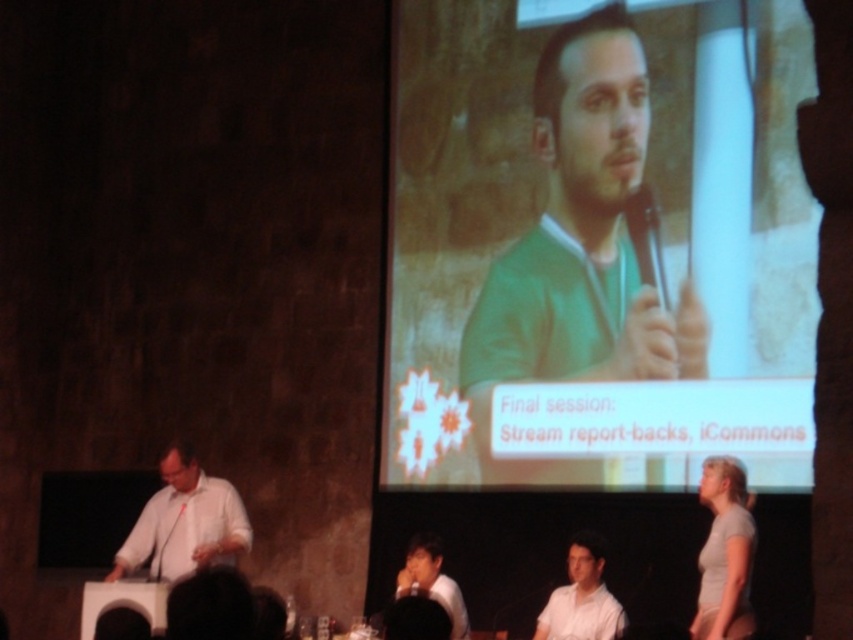
Which is behind, point (714, 522) or point (422, 580)?

Positioned behind is point (422, 580).

You are a GUI agent. You are given a task and a screenshot of the screen. Output one action in this format:
    pyautogui.click(x=<x>, y=<y>)
    Task: Click on the white matte shirt at lower right
    This screenshot has height=640, width=853.
    Given the screenshot: What is the action you would take?
    pyautogui.click(x=724, y=554)

Who is more forward, (509,172) or (405,570)?

Point (509,172) is in front.

How much distance is there between green fabric at upper center and white matte shirt at lower center?

green fabric at upper center is 10.04 meters away from white matte shirt at lower center.

Which is in front, point (426, 419) or point (405, 554)?

Positioned in front is point (426, 419).

The image size is (853, 640). What are the coordinates of `green fabric at upper center` in the screenshot? It's located at (598, 241).

Who is more forward, (x=553, y=234) or (x=589, y=540)?

Positioned in front is point (x=589, y=540).

Can you confirm if green fabric at upper center is shorter than white matte shirt at center?

Incorrect, green fabric at upper center's height does not fall short of white matte shirt at center's.

What do you see at coordinates (598, 241) in the screenshot? I see `green fabric at upper center` at bounding box center [598, 241].

The height and width of the screenshot is (640, 853). I want to click on green fabric at upper center, so click(598, 241).